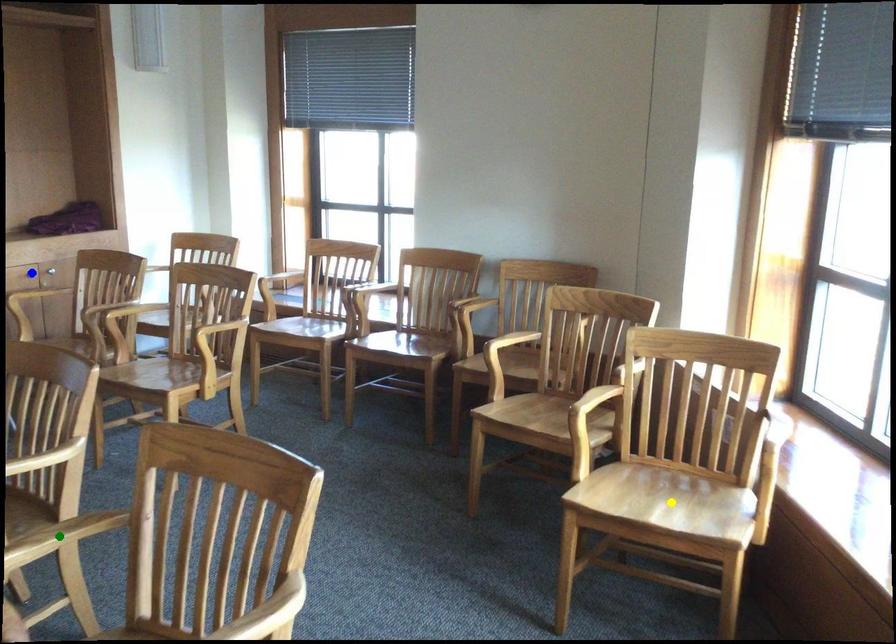
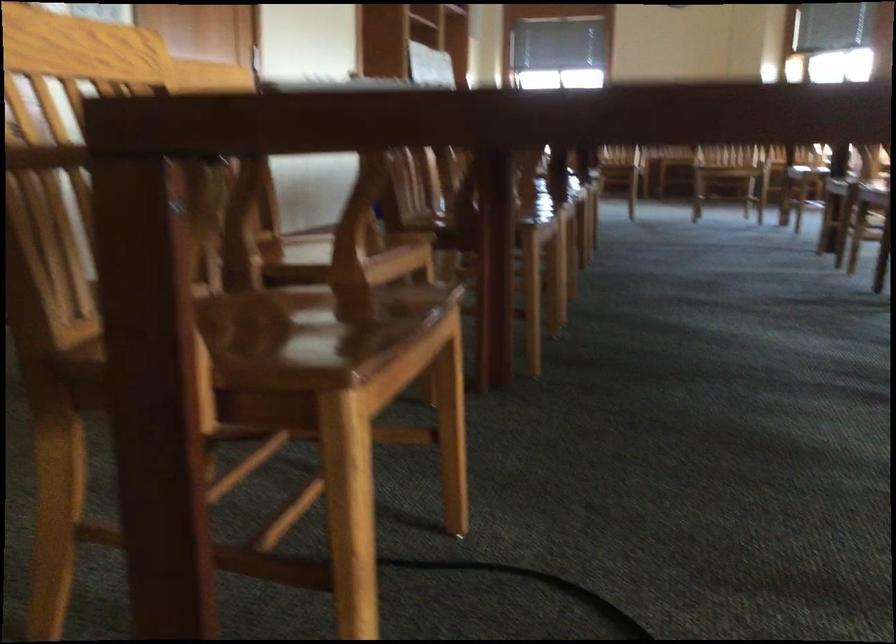
I am providing you with two images of the same scene from different viewpoints. Three points are marked in image1. Which point corresponds to a part or object that is occluded in image2?In image1, three points are marked. Which of them correspond to a part or object that is occluded in image2?Among the three points shown in image1, which one corresponds to a part or object that is no longer visible due to occlusion in image2?

yellow point, blue point, green point cannot be seen in image2.